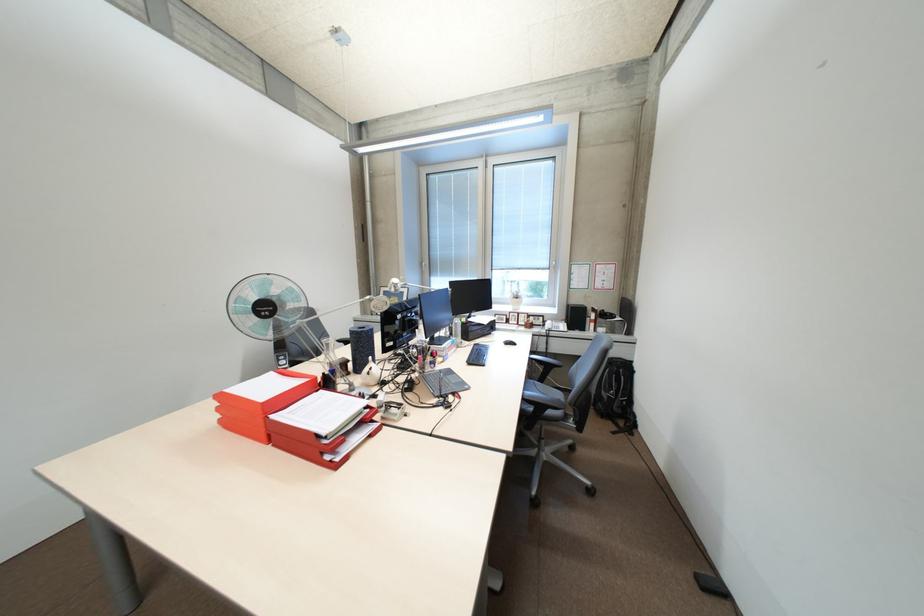
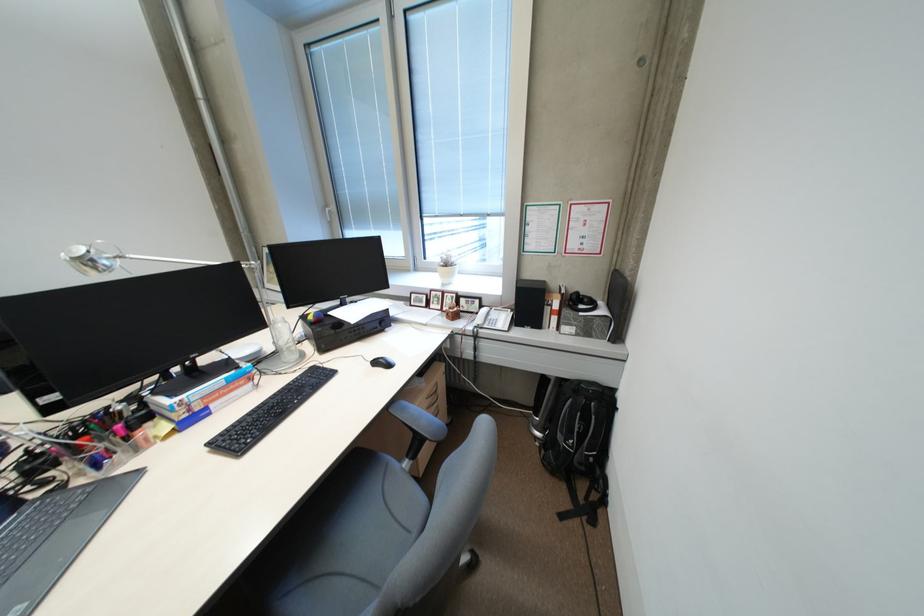
The point at (553, 323) is marked in the first image. Where is the corresponding point in the second image?

(487, 314)